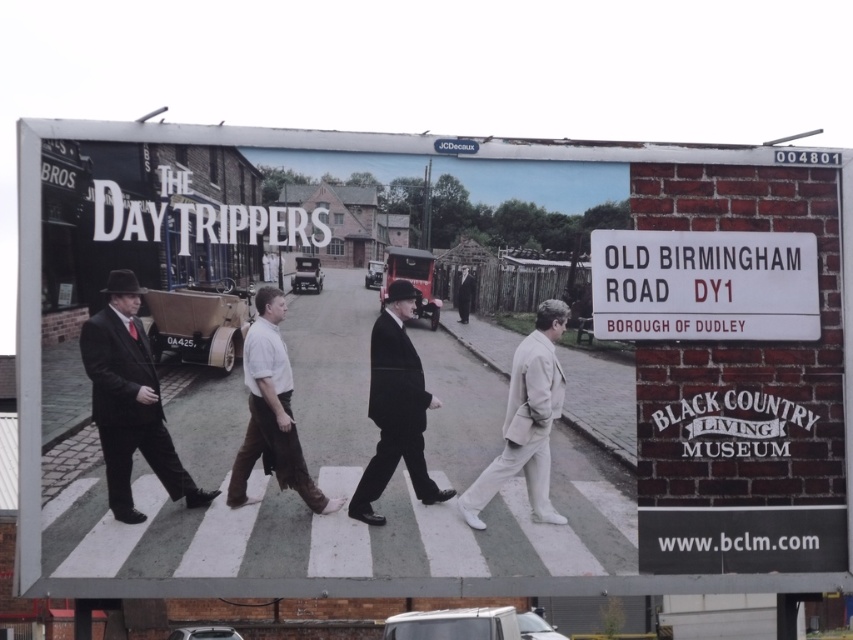
Question: Does matte black suit at center have a smaller size compared to brown cotton pants at center?

Choices:
 (A) no
 (B) yes

Answer: (A)

Question: Which point appears closest to the camera in this image?

Choices:
 (A) (335, 429)
 (B) (413, 352)
 (C) (558, 308)

Answer: (A)

Question: Which object is the farthest from the white plastic sign at upper right?

Choices:
 (A) brown cotton pants at center
 (B) matte black signboard at upper center

Answer: (B)

Question: Can you confirm if matte black suit at center is positioned below dark gray suit at center?

Choices:
 (A) yes
 (B) no

Answer: (A)

Question: Which of the following is the closest to the observer?

Choices:
 (A) white plastic sign at upper right
 (B) matte black suit at center
 (C) black wool suit at center
 (D) matte black signboard at upper center

Answer: (D)

Question: Can you confirm if matte black suit at center is positioned to the right of black wool suit at center?

Choices:
 (A) no
 (B) yes

Answer: (A)